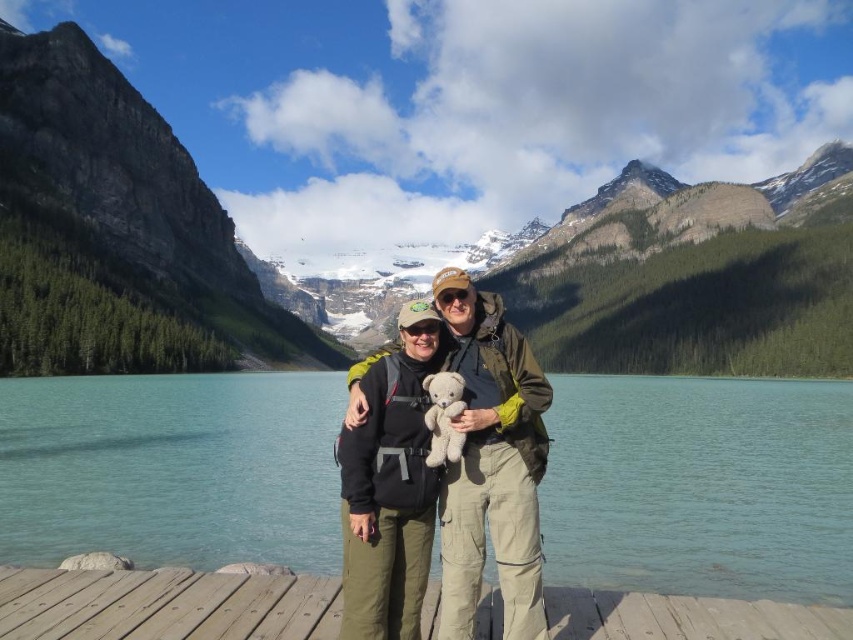
You are a photographer trying to capture a wide shot of the wooden dock at center and the white plush bear at center. Given that your camera has a maximum width capacity of 2 meters, can both objects fit in the frame without cropping?

The wooden dock at center is wider than the white plush bear at center. Since the camera can capture up to 2 meters in width, and the dock is wider, it depends on the dock width. However, since the bear is smaller and the dock is wider but possibly longer, but the question is about width. If the dock is wider than 2 meters, then no. But since the description only says the dock is wider than the bear, but not the exact measurement, the answer can not be determined with the given info.

You are standing on the wooden dock and want to take a photo of both the green rock mountain at center and the white plush bear at center. Which object should you focus on first to ensure it appears clearer in the photo?

You should focus on the green rock mountain at center first because it is closer to you than the white plush bear at center, so capturing it in focus will ensure clarity.

You are a photographer planning to take a photo of the wooden dock at center and the white plush bear at center. Since you want to ensure both subjects are clearly visible, which object should you focus on first considering their heights?

The wooden dock at center has a lesser height compared to the white plush bear at center, so you should focus on the white plush bear at center first to ensure proper focus on the taller subject.